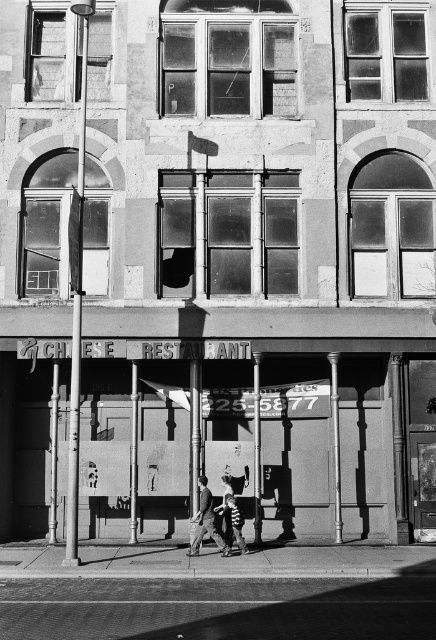
Does smooth concrete storefront at center appear over smooth concrete sidewalk at lower center?

Yes, smooth concrete storefront at center is above smooth concrete sidewalk at lower center.

In the scene shown: Measure the distance between smooth concrete storefront at center and smooth concrete sidewalk at lower center.

The distance of smooth concrete storefront at center from smooth concrete sidewalk at lower center is 3.42 meters.

At what (x,y) coordinates should I click in order to perform the action: click on smooth concrete storefront at center. Please return your answer as a coordinate pair (x, y). Image resolution: width=436 pixels, height=640 pixels. Looking at the image, I should click on (265, 436).

I want to click on smooth concrete storefront at center, so click(x=265, y=436).

Which is in front, point (280, 442) or point (37, 600)?

Point (37, 600)

Does smooth concrete storefront at center have a smaller size compared to smooth asphalt road at bottom?

Actually, smooth concrete storefront at center might be larger than smooth asphalt road at bottom.

The width and height of the screenshot is (436, 640). I want to click on smooth concrete storefront at center, so click(265, 436).

Which of these two, smooth asphalt road at bottom or dark gray fabric pants at center, stands shorter?

Standing shorter between the two is smooth asphalt road at bottom.

Who is lower down, smooth asphalt road at bottom or dark gray fabric pants at center?

smooth asphalt road at bottom is below.

Who is more distant from viewer, (197, 627) or (208, 525)?

The point (208, 525) is more distant.

This screenshot has width=436, height=640. I want to click on smooth asphalt road at bottom, so click(x=218, y=609).